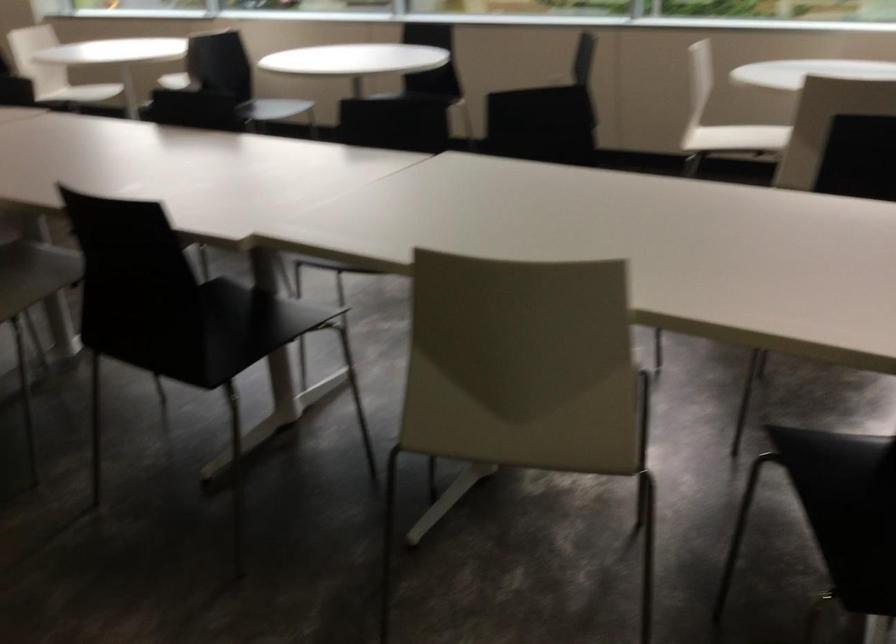
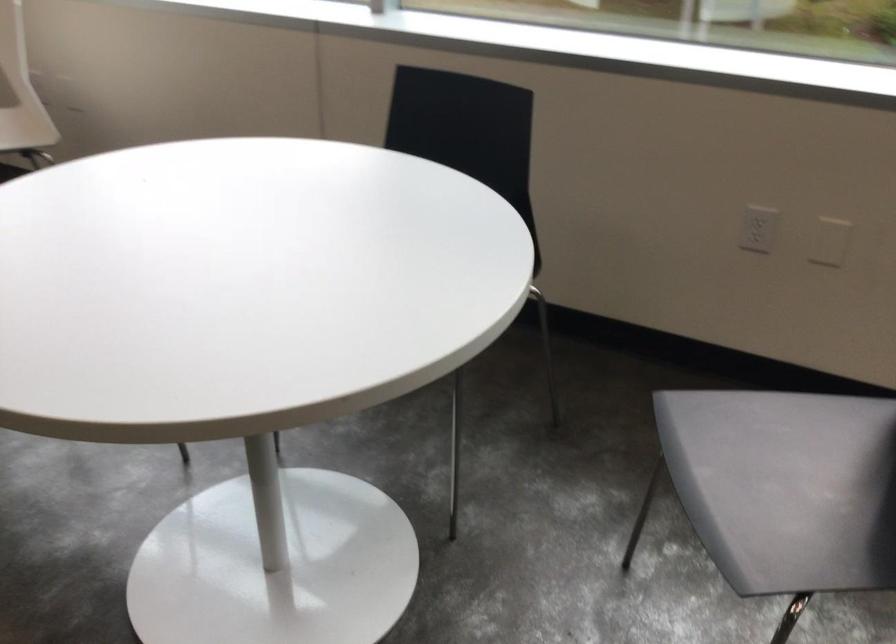
Question: What movement of the cameraman would produce the second image?

Choices:
 (A) Left
 (B) Right
 (C) Forward
 (D) Backward

Answer: (C)